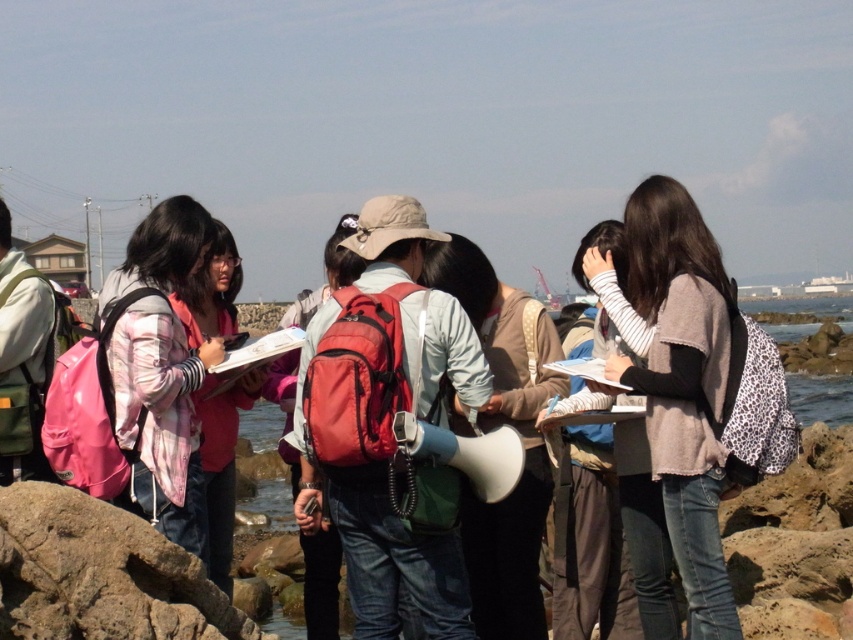
Based on the photo, you are a member of the group standing near the rough textured rock at lower left and the pink fabric jacket at left. Which object is positioned lower in the scene?

The rough textured rock at lower left is located below the pink fabric jacket at left, so it is positioned lower in the scene.

You are standing at the shoreline and want to reach a specific point marked at coordinates point (653, 284). If your maximum walking distance is 40 meters, can you reach that point without exceeding your limit?

The distance of point (653, 284) from viewer is 44.23 meters, so you cannot reach it within your 40 meter limit.

You are a member of the group and want to take a photo of the rough textured rock at lower left and the pink fabric jacket at left. Which object is shorter in height?

The rough textured rock at lower left is not as tall as the pink fabric jacket at left, so the rough textured rock at lower left is shorter in height.